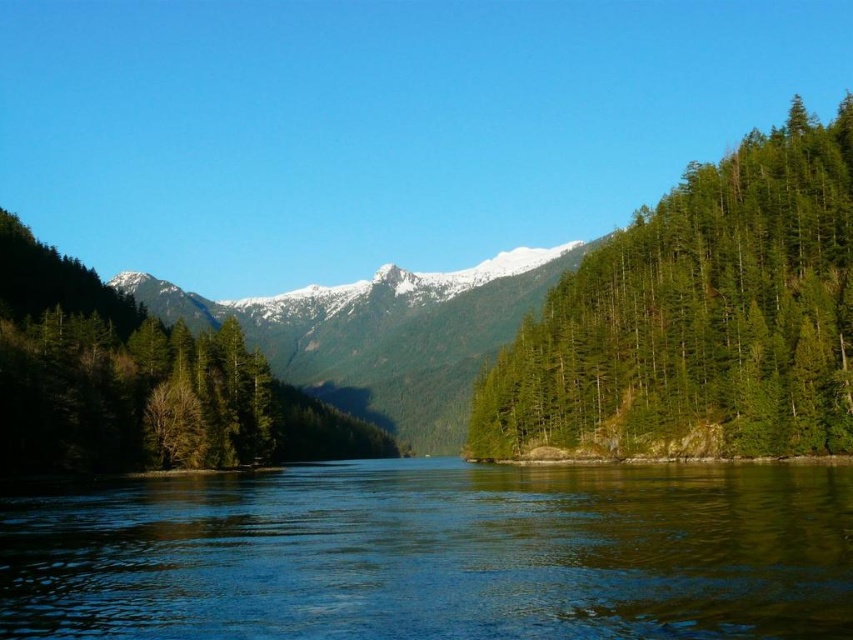
You are an outdoor enthusiast planning a hiking route. You see the green textured forest at right and the snowy rocky mountain at center. Which of these two landmarks is closer to your current position?

The green textured forest at right is closer to your current position because it is in front of the snowy rocky mountain at center.